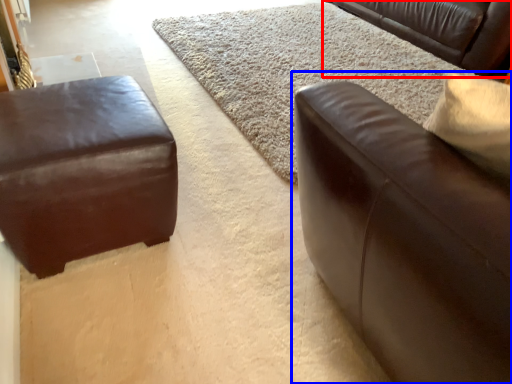
Question: Which point is closer to the camera, studio couch (highlighted by a red box) or studio couch (highlighted by a blue box)?

Choices:
 (A) studio couch
 (B) studio couch

Answer: (B)